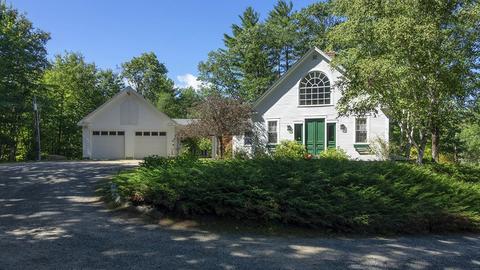
The width and height of the screenshot is (480, 270). I want to click on windows, so click(x=311, y=90), click(x=360, y=128), click(x=273, y=127), click(x=248, y=139).